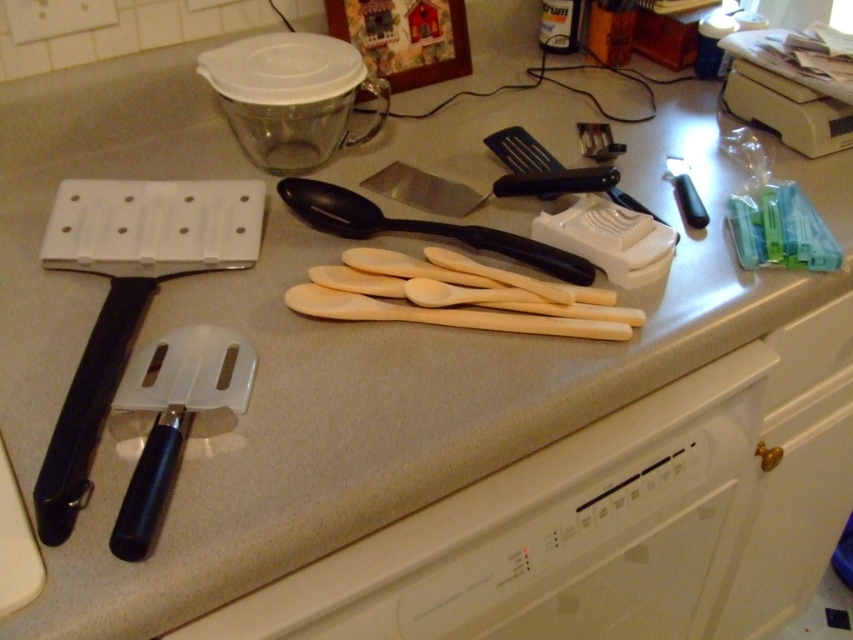
Question: Among these objects, which one is farthest from the camera?

Choices:
 (A) black plastic spatula at left
 (B) white glossy oven at lower center
 (C) white plastic spatula at left
 (D) black plastic spoon at center

Answer: (D)

Question: Based on their relative distances, which object is farther from the black plastic spatula at left?

Choices:
 (A) transparent glass jar at upper center
 (B) white plastic spatula at left
 (C) black plastic spoon at center

Answer: (C)

Question: Is black plastic spatula at left to the left of white plastic spatula at left from the viewer's perspective?

Choices:
 (A) yes
 (B) no

Answer: (A)

Question: Observing the image, what is the correct spatial positioning of black plastic spatula at left in reference to white plastic spatula at left?

Choices:
 (A) above
 (B) below

Answer: (A)

Question: Can you confirm if black plastic spatula at left is positioned below black plastic spoon at center?

Choices:
 (A) no
 (B) yes

Answer: (B)

Question: Which point is farther to the camera?

Choices:
 (A) black plastic spoon at center
 (B) white plastic spatula at left
 (C) black plastic spatula at left
 (D) transparent glass jar at upper center

Answer: (D)